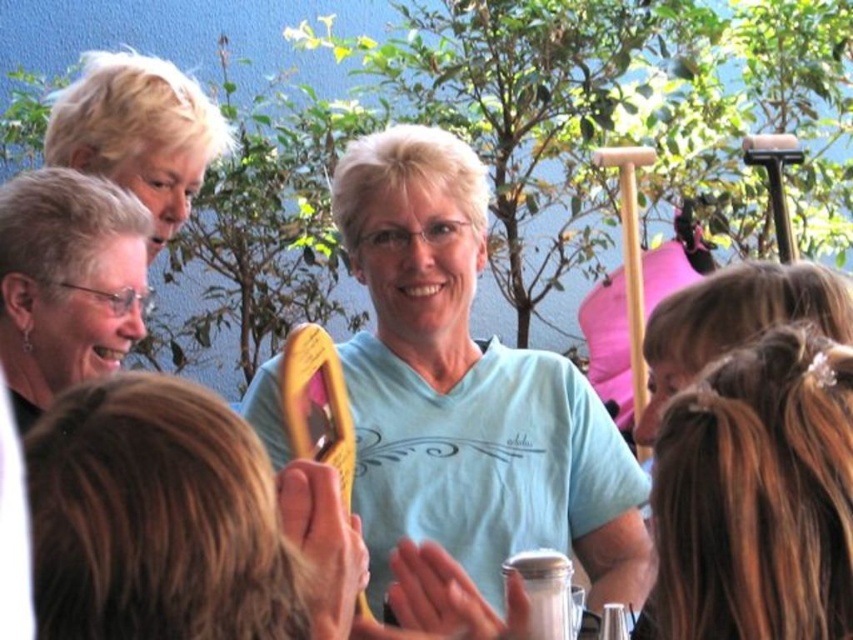
You are a chef holding a wooden spoon at center and need to stir a pot. There is also a person with matte black hair at left nearby. Can you stir the pot without hitting the person?

The wooden spoon at center might be wider than matte black hair at left, so there is a possibility that stirring the pot could hit the person. It is recommended to check the distance before stirring.

You are holding a wooden spoon at center and want to use it to stir a pot of soup. The pot is placed near the matte black hair at left. Can you reach the pot from where you are standing?

The wooden spoon at center is not as tall as matte black hair at left, so the distance between them might be manageable. However, since the spoon itself is shorter than the hair, it might not extend far enough to reach the pot unless you move closer.

Where is the light blue cotton shirt at center located in the image?

The light blue cotton shirt at center is located at point (468, 390).